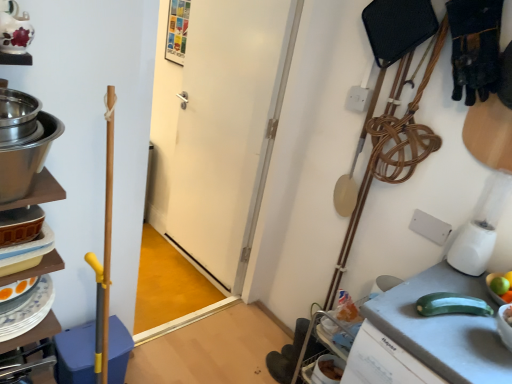
Question: From the image's perspective, is white plastic blender at right positioned above or below stainless steel bowls at left?

Choices:
 (A) above
 (B) below

Answer: (B)

Question: From a real-world perspective, is white plastic blender at right positioned above or below stainless steel bowls at left?

Choices:
 (A) above
 (B) below

Answer: (B)

Question: Considering the real-world distances, which object is closest to the green matte zucchini at lower right?

Choices:
 (A) green matte apple at right
 (B) yellow smooth zucchini at right
 (C) stainless steel bowls at left
 (D) white matte door at center
 (E) white plastic blender at right

Answer: (B)

Question: Which is nearer to the white plastic blender at right?

Choices:
 (A) yellow smooth zucchini at right
 (B) green matte zucchini at lower right
 (C) stainless steel bowls at left
 (D) white matte door at center
 (E) green matte apple at right

Answer: (E)